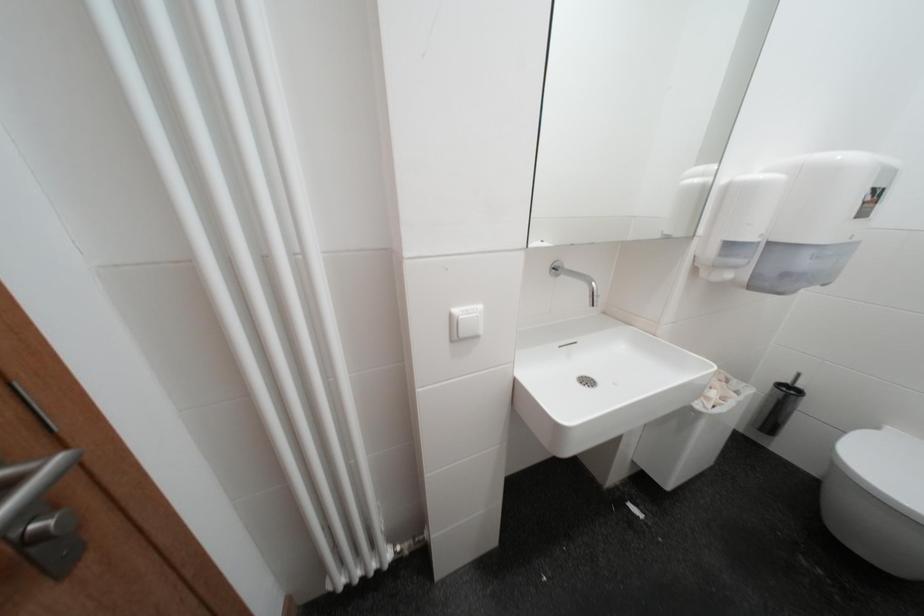
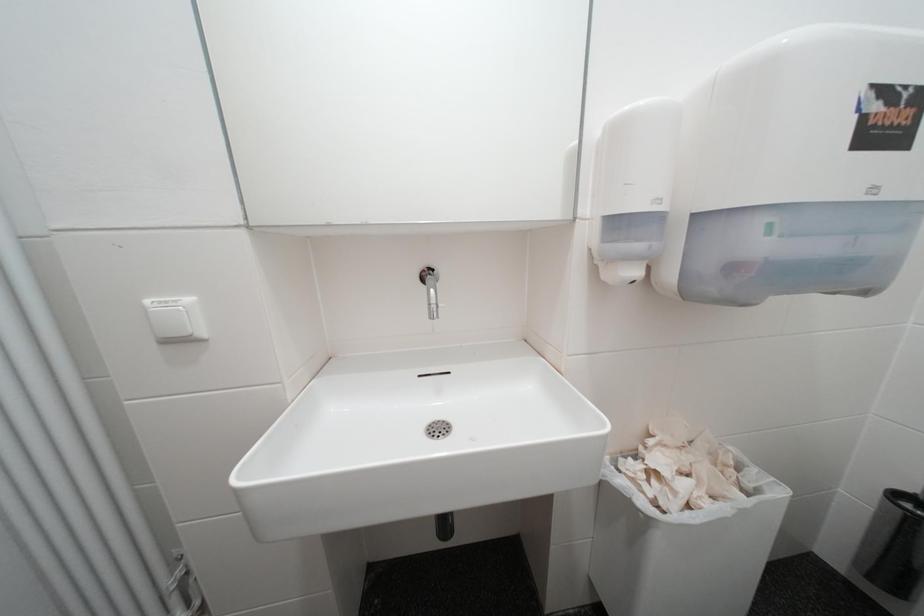
Question: The camera is either moving clockwise (left) or counter-clockwise (right) around the object. The first image is from the beginning of the video and the second image is from the end. Is the camera moving left or right when shooting the video?

Choices:
 (A) Left
 (B) Right

Answer: (B)